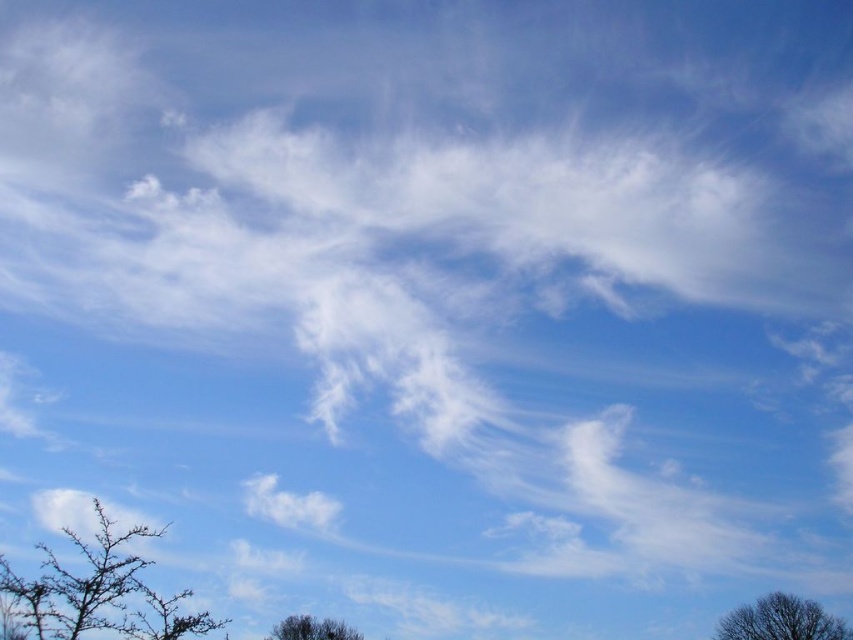
Is brown spiky branches at lower left bigger than dark brown textured tree at lower center?

No.

Can you confirm if brown spiky branches at lower left is positioned to the right of dark brown textured tree at lower center?

In fact, brown spiky branches at lower left is to the left of dark brown textured tree at lower center.

Locate an element on the screen. This screenshot has width=853, height=640. brown spiky branches at lower left is located at coordinates (94, 593).

Between brown spiky branches at lower left and brown textured tree at lower right, which one has less height?

With less height is brown textured tree at lower right.

Who is more distant from viewer, (97, 531) or (781, 618)?

The point (781, 618) is more distant.

Image resolution: width=853 pixels, height=640 pixels. I want to click on brown spiky branches at lower left, so click(x=94, y=593).

Which is in front, point (792, 608) or point (316, 637)?

Point (792, 608) is in front.

Between brown textured tree at lower right and dark brown textured tree at lower center, which one has less height?

brown textured tree at lower right

At what (x,y) coordinates should I click in order to perform the action: click on brown textured tree at lower right. Please return your answer as a coordinate pair (x, y). Image resolution: width=853 pixels, height=640 pixels. Looking at the image, I should click on (781, 620).

This screenshot has height=640, width=853. I want to click on brown textured tree at lower right, so (781, 620).